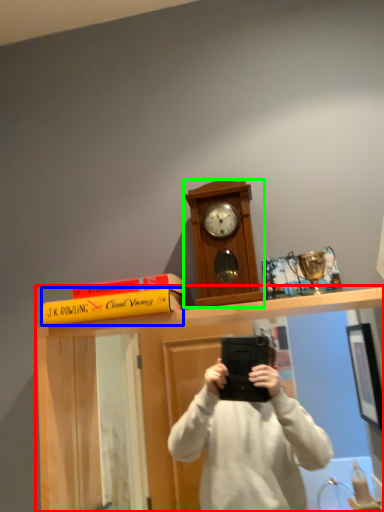
Question: Which object is the closest to the vanity (highlighted by a red box)? Choose among these: book (highlighted by a blue box) or clock (highlighted by a green box).

Choices:
 (A) book
 (B) clock

Answer: (A)